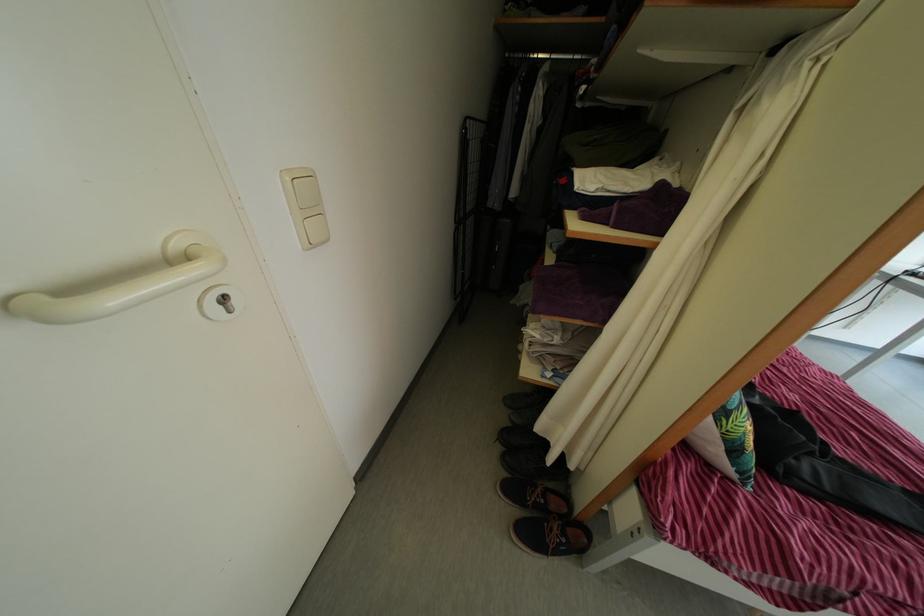
The width and height of the screenshot is (924, 616). Describe the element at coordinates (220, 302) in the screenshot. I see `the door keyhole` at that location.